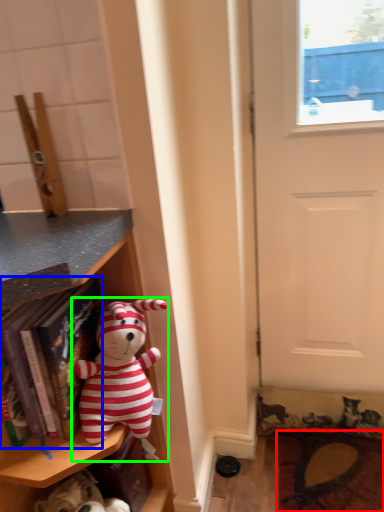
Question: Which is nearer to the doormat (highlighted by a red box)? book (highlighted by a blue box) or toy (highlighted by a green box).

Choices:
 (A) book
 (B) toy

Answer: (B)